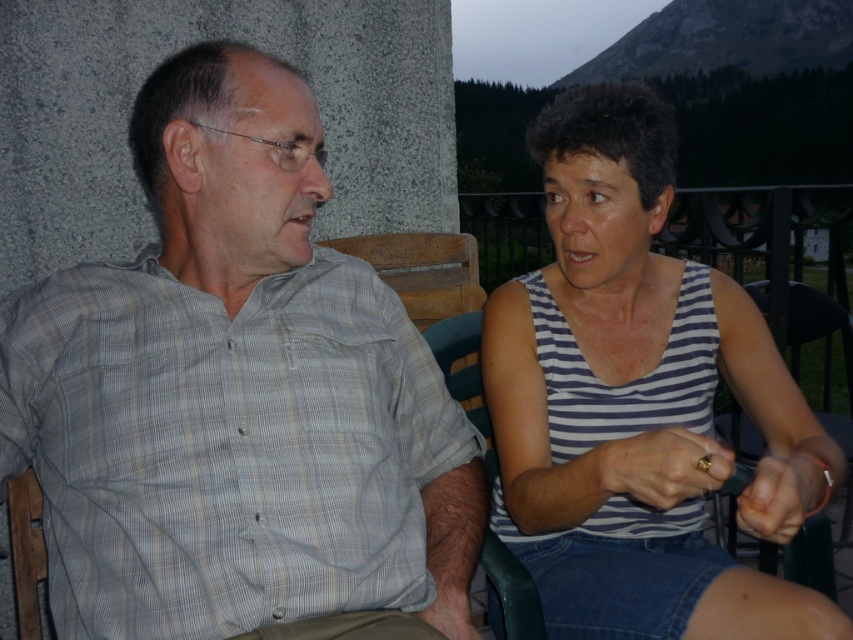
Question: Which point is farther from the camera taking this photo?

Choices:
 (A) (125, 547)
 (B) (618, 195)

Answer: (B)

Question: Is gray plaid shirt at left thinner than striped fabric tank top at right?

Choices:
 (A) yes
 (B) no

Answer: (B)

Question: Is gray plaid shirt at left closer to the viewer compared to striped fabric tank top at right?

Choices:
 (A) yes
 (B) no

Answer: (B)

Question: Considering the relative positions of gray plaid shirt at left and striped fabric tank top at right in the image provided, where is gray plaid shirt at left located with respect to striped fabric tank top at right?

Choices:
 (A) below
 (B) above

Answer: (B)

Question: Which of the following is the closest to the observer?

Choices:
 (A) gray plaid shirt at left
 (B) striped fabric tank top at right

Answer: (B)